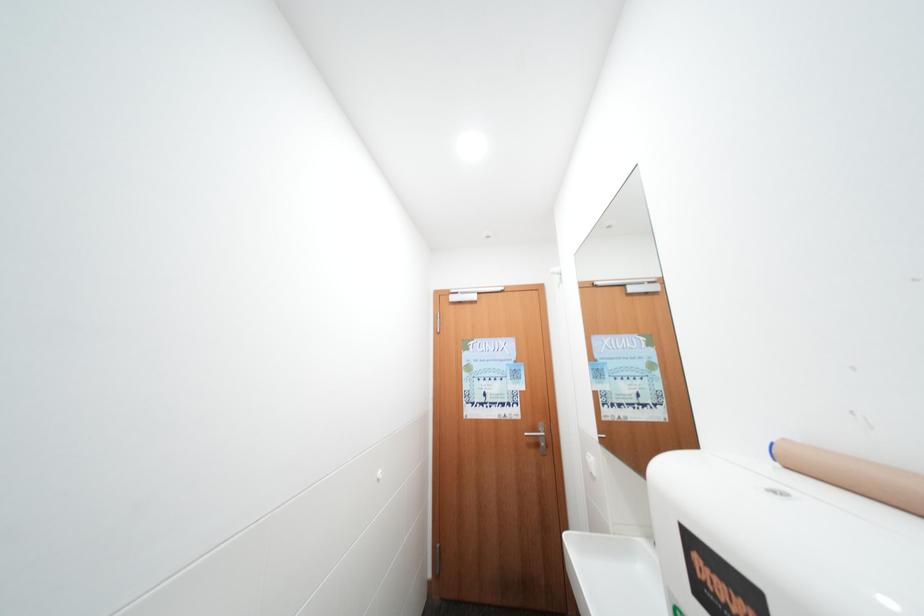
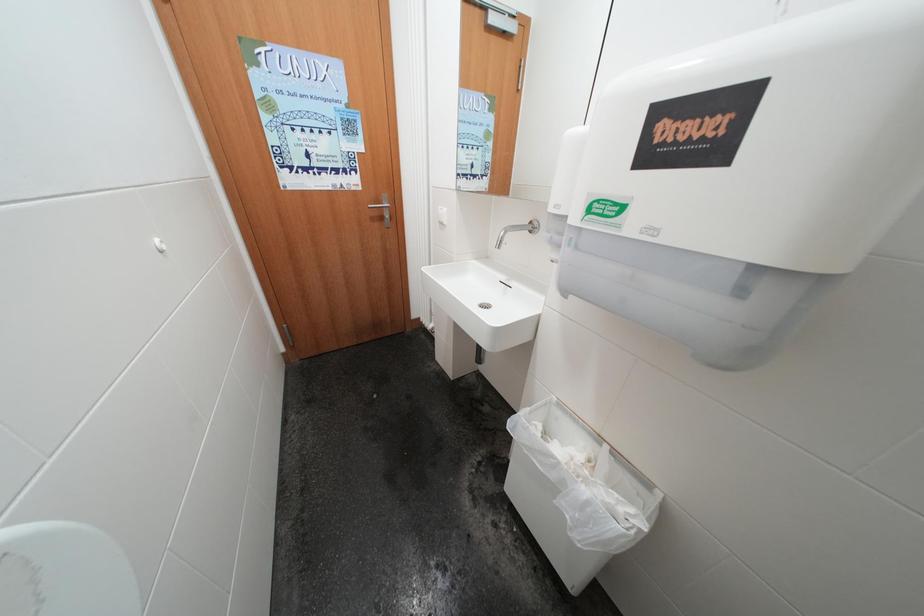
The images are taken continuously from a first-person perspective. In which direction is your viewpoint rotating?

The camera's rotation is toward right-down.